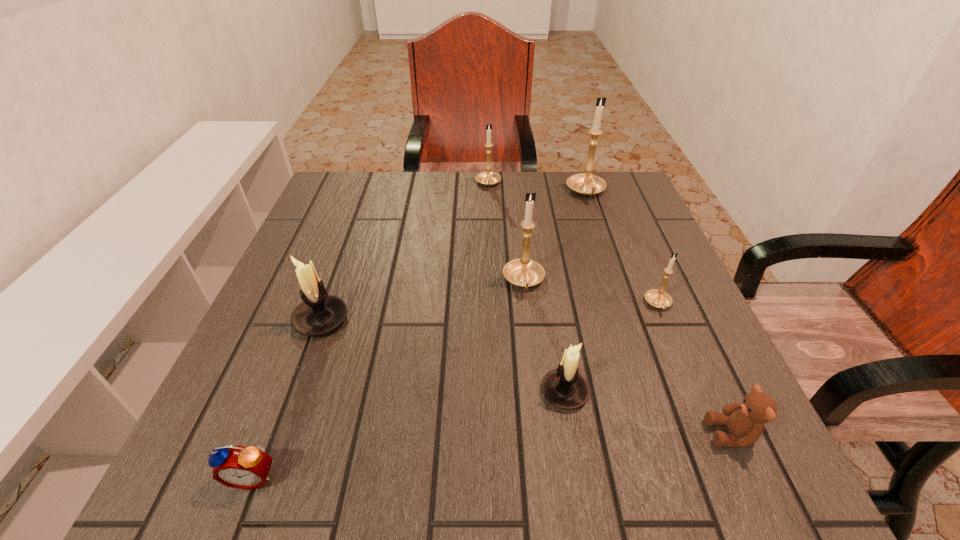
Image resolution: width=960 pixels, height=540 pixels. I want to click on the tallest candle holder, so click(587, 184).

In order to click on the biggest gold candle holder in this screenshot , I will do `click(587, 184)`.

Image resolution: width=960 pixels, height=540 pixels. Identify the location of the second tallest candle holder. (523, 272).

Locate an element on the screen. the second biggest gold candle holder is located at coordinates (523, 272).

This screenshot has width=960, height=540. Find the location of `the second smallest gold candle holder`. the second smallest gold candle holder is located at coordinates (488, 178).

Where is `the leftmost candle holder`? The height and width of the screenshot is (540, 960). the leftmost candle holder is located at coordinates (320, 313).

Where is `the bigger white candle holder`? the bigger white candle holder is located at coordinates (320, 313).

Where is `the smallest gold candle holder`? The image size is (960, 540). the smallest gold candle holder is located at coordinates (657, 298).

Where is `the nearer white candle holder`? The height and width of the screenshot is (540, 960). the nearer white candle holder is located at coordinates (564, 387).

This screenshot has height=540, width=960. What are the coordinates of `the nearest candle holder` in the screenshot? It's located at (564, 387).